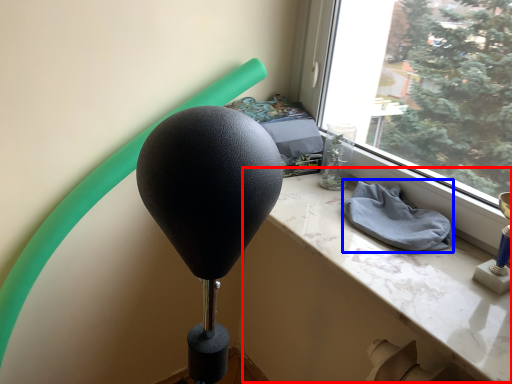
Question: Among these objects, which one is farthest to the camera, table (highlighted by a red box) or cloth (highlighted by a blue box)?

Choices:
 (A) table
 (B) cloth

Answer: (B)